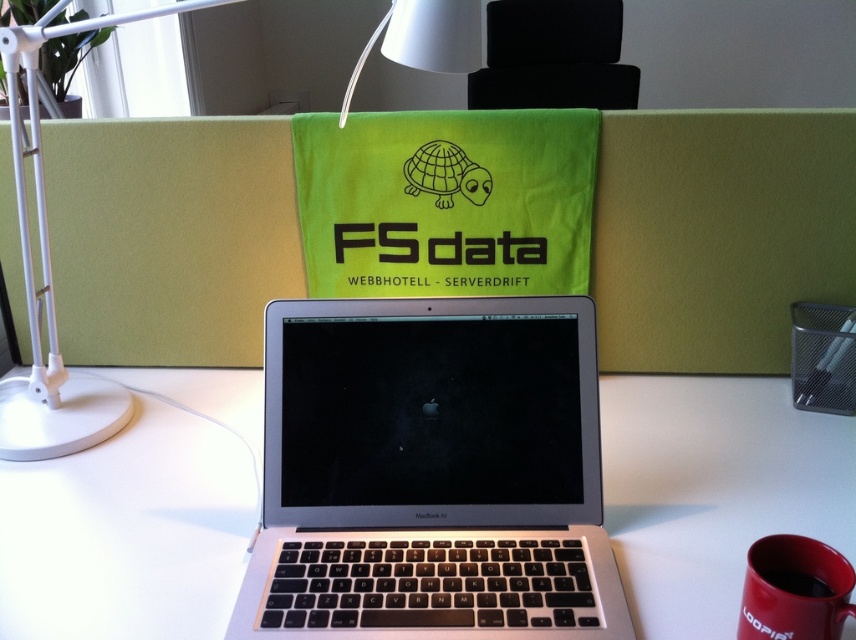
Question: Which of the following is the farthest from the observer?

Choices:
 (A) (450, 65)
 (B) (328, 627)

Answer: (A)

Question: Can you confirm if black matte turtle at center is thinner than red matte coffee cup at lower right?

Choices:
 (A) yes
 (B) no

Answer: (B)

Question: Which object is positioned farthest from the white plastic table lamp at upper left?

Choices:
 (A) matte red mug at lower right
 (B) white matte table at center
 (C) sleek silver laptop at center
 (D) black matte turtle at center

Answer: (A)

Question: From the image, what is the correct spatial relationship of matte red mug at lower right in relation to red matte coffee cup at lower right?

Choices:
 (A) above
 (B) below

Answer: (B)

Question: Which object is farther from the camera taking this photo?

Choices:
 (A) white plastic table lamp at upper left
 (B) white plastic table lamp at upper center
 (C) white matte table at center

Answer: (B)

Question: Does sleek silver laptop at center appear over white plastic table lamp at upper center?

Choices:
 (A) no
 (B) yes

Answer: (A)